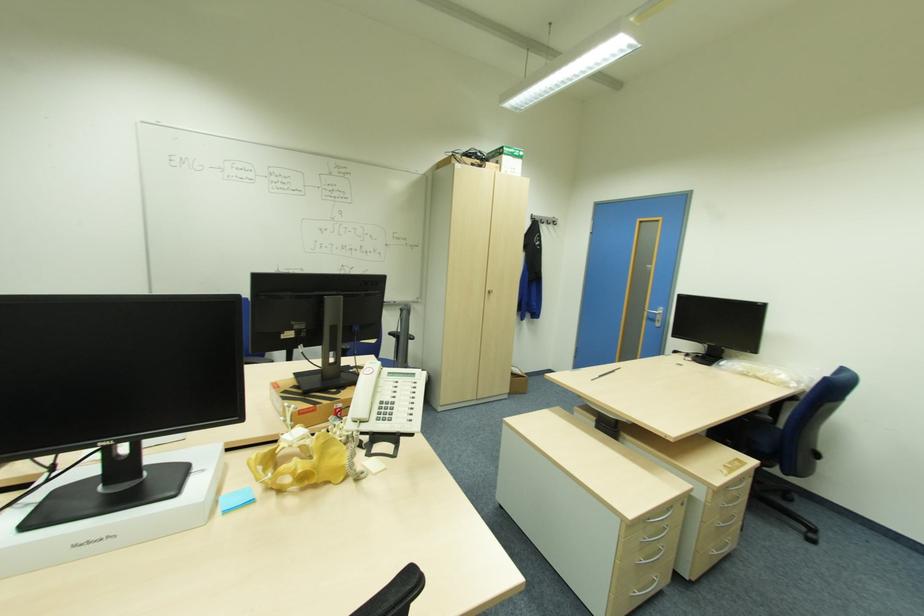
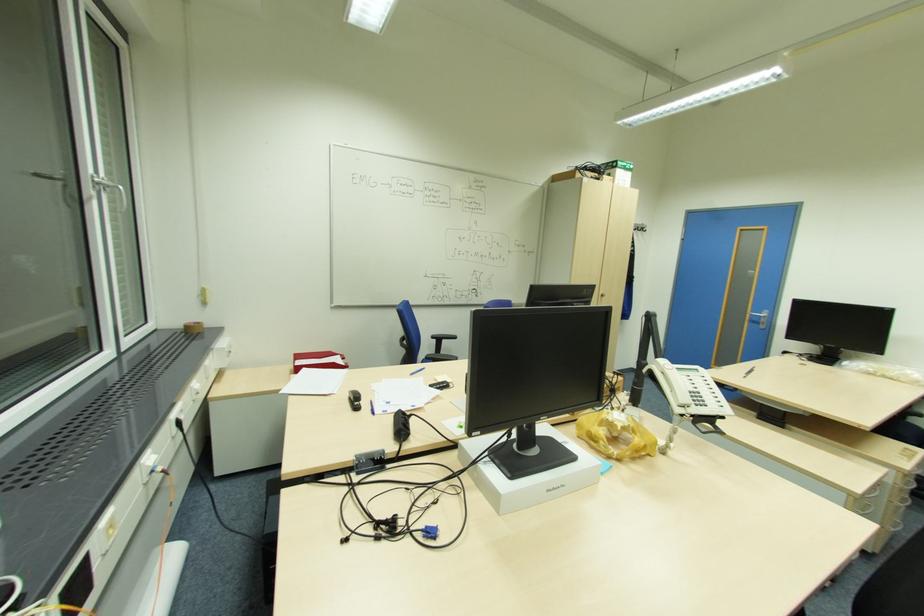
In the second image, find the point that corresponds to (x=381, y=419) in the first image.

(699, 403)